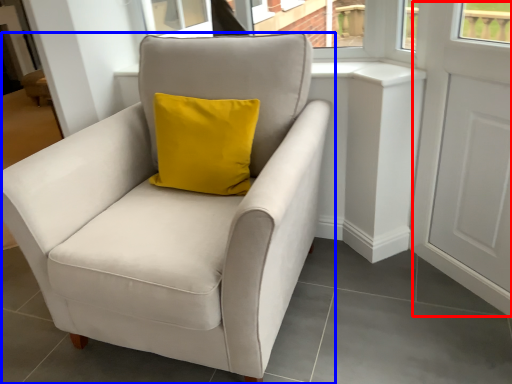
Question: Which object appears farthest to the camera in this image, screen door (highlighted by a red box) or chair (highlighted by a blue box)?

Choices:
 (A) screen door
 (B) chair

Answer: (A)